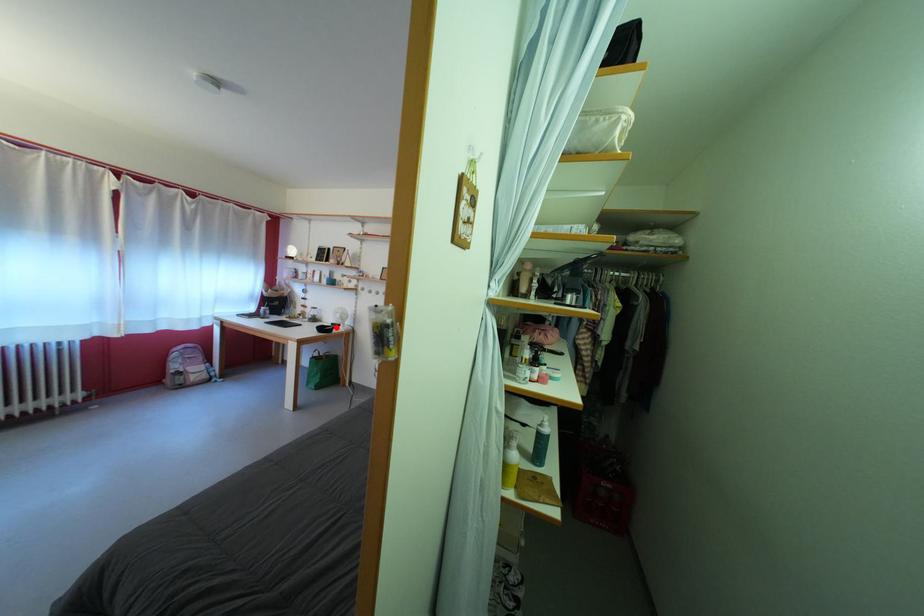
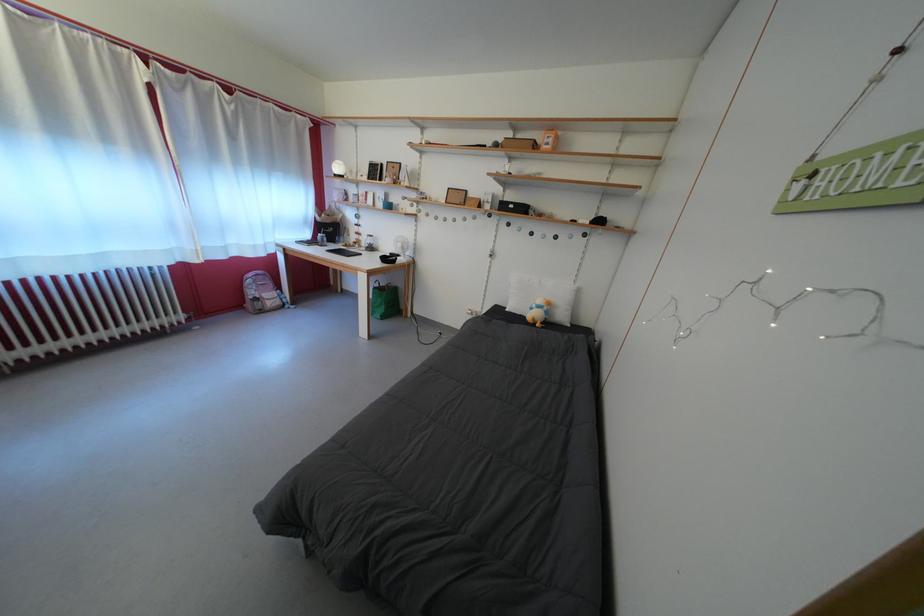
Question: I am providing you with two images of the same scene from different viewpoints. Image1 has a red point marked. In image2, the corresponding 3D location appears at what relative position? Reply with the corresponding letter.

Choices:
 (A) Closer
 (B) Farther

Answer: (A)